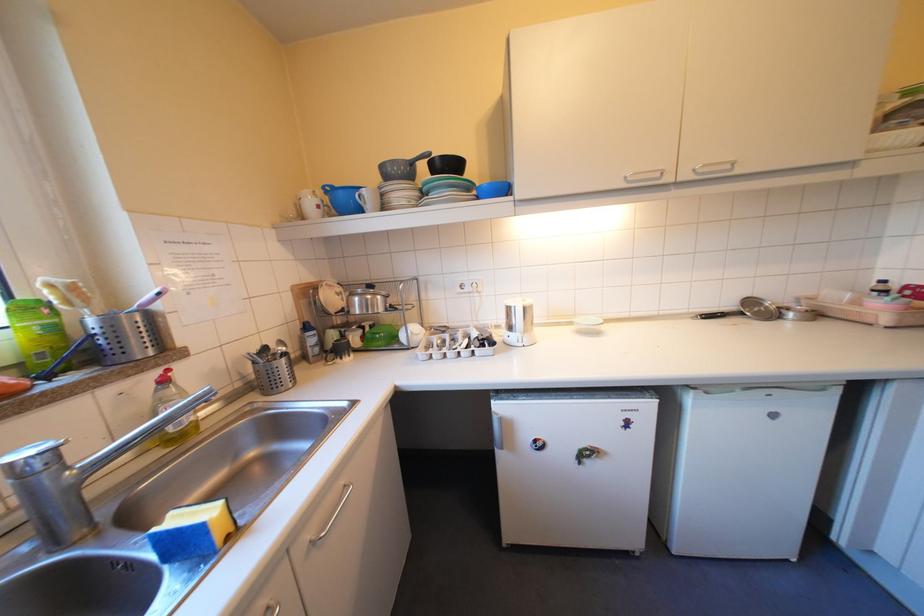
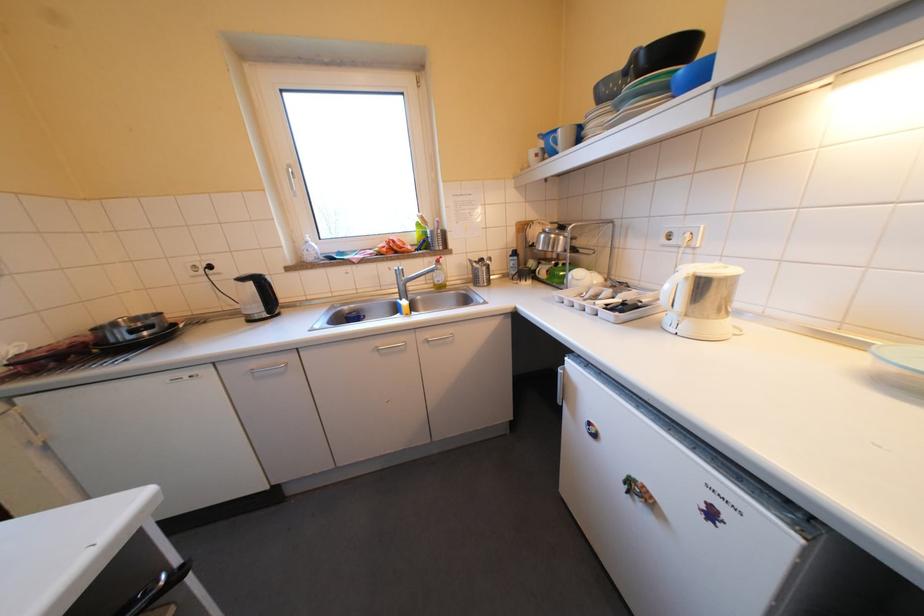
The images are taken continuously from a first-person perspective. In which direction is your viewpoint rotating?

The rotation direction of the camera is left-down.